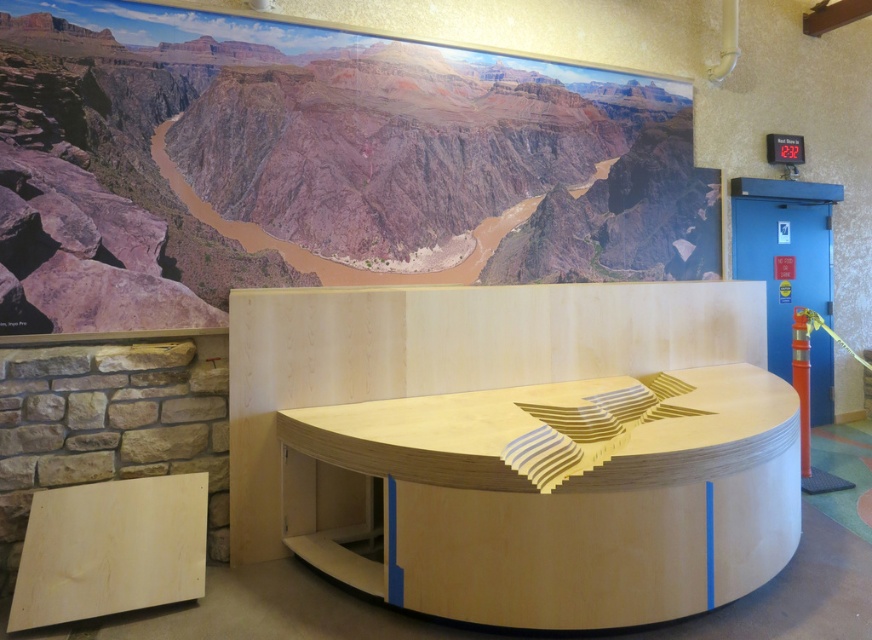
Question: Does light wood/plywood table at center appear on the left side of natural wood stool at lower left?

Choices:
 (A) no
 (B) yes

Answer: (A)

Question: Which object is farther from the camera taking this photo?

Choices:
 (A) light wood/plywood table at center
 (B) natural wood stool at lower left

Answer: (B)

Question: Among these points, which one is nearest to the camera?

Choices:
 (A) (191, 476)
 (B) (699, 602)

Answer: (B)

Question: Is light wood/plywood table at center below natural wood stool at lower left?

Choices:
 (A) no
 (B) yes

Answer: (A)

Question: Can you confirm if light wood/plywood table at center is positioned to the left of natural wood stool at lower left?

Choices:
 (A) no
 (B) yes

Answer: (A)